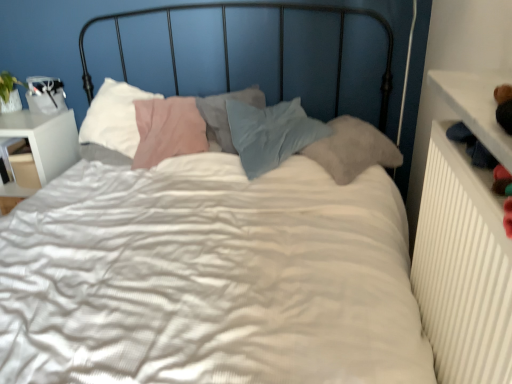
The width and height of the screenshot is (512, 384). What are the coordinates of `white textured radiator at right` in the screenshot? It's located at [463, 267].

What do you see at coordinates (463, 267) in the screenshot? The width and height of the screenshot is (512, 384). I see `white textured radiator at right` at bounding box center [463, 267].

You are a GUI agent. You are given a task and a screenshot of the screen. Output one action in this format:
    pyautogui.click(x=<x>, y=<y>)
    Task: Click on the white textured radiator at right
    
    Given the screenshot: What is the action you would take?
    pyautogui.click(x=463, y=267)